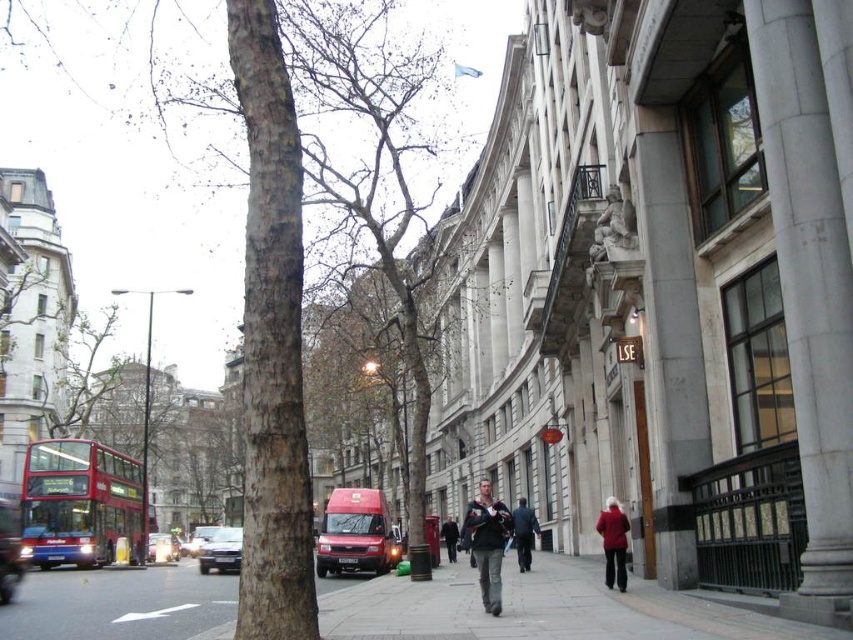
Does smooth gray stone column at center right appear on the right side of matte red van at center?

Indeed, smooth gray stone column at center right is positioned on the right side of matte red van at center.

Based on the photo, is smooth gray stone column at center right wider than matte red van at center?

In fact, smooth gray stone column at center right might be narrower than matte red van at center.

Who is more forward, (790,346) or (390,538)?

Positioned in front is point (790,346).

Where is `smooth gray stone column at center right`? This screenshot has width=853, height=640. smooth gray stone column at center right is located at coordinates (809, 285).

Does dark gray fabric jacket at center appear under dark blue jacket at center?

Indeed, dark gray fabric jacket at center is positioned under dark blue jacket at center.

Does dark gray fabric jacket at center appear over dark blue jacket at center?

Incorrect, dark gray fabric jacket at center is not positioned above dark blue jacket at center.

Which is behind, point (498, 595) or point (535, 531)?

Positioned behind is point (535, 531).

At what (x,y) coordinates should I click in order to perform the action: click on dark gray fabric jacket at center. Please return your answer as a coordinate pair (x, y). Looking at the image, I should click on (486, 541).

Consider the image. Who is higher up, smooth gray stone column at center right or dark gray fabric jacket at center?

Positioned higher is smooth gray stone column at center right.

Does point (851, 330) come behind point (496, 612)?

No, it is in front of (496, 612).

Where is `smooth gray stone column at center right`? smooth gray stone column at center right is located at coordinates (809, 285).